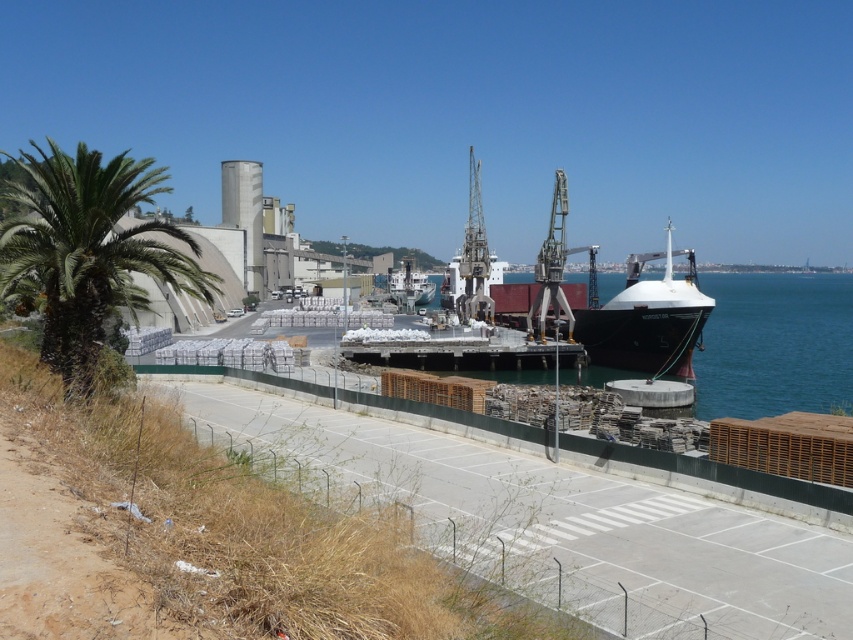
You are standing on the paved road and want to take a photo of the white matte boat at center. To ensure the green leafy palm tree at left doesn not block the view, should you move closer to or farther away from the palm tree?

The green leafy palm tree at left might be wider than the white matte boat at center, so to avoid blocking the view, you should move farther away from the palm tree to get a wider angle that includes both the boat and the palm tree without overlap.

You are standing at the center of the paved road in the coastal industrial scene. Looking towards the green leafy palm tree at left, can you estimate its position relative to your current viewpoint?

The green leafy palm tree at left is located at coordinates approximately 0.391 along the horizontal axis and 0.104 along the vertical axis relative to your viewpoint.